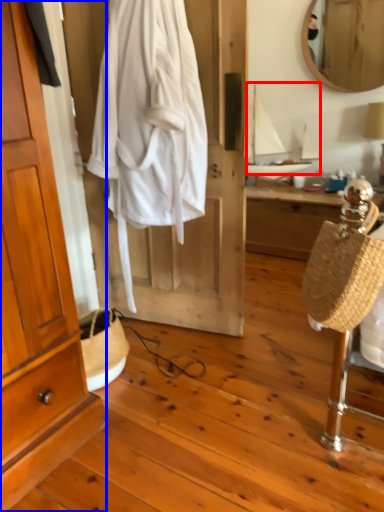
Question: Among these objects, which one is nearest to the camera, sailboat (highlighted by a red box) or cabinetry (highlighted by a blue box)?

Choices:
 (A) sailboat
 (B) cabinetry

Answer: (B)